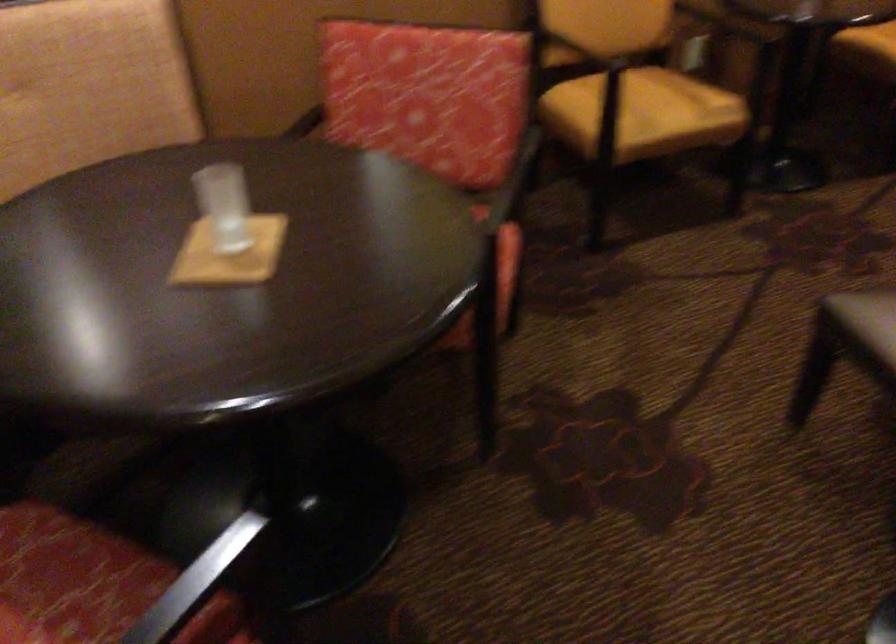
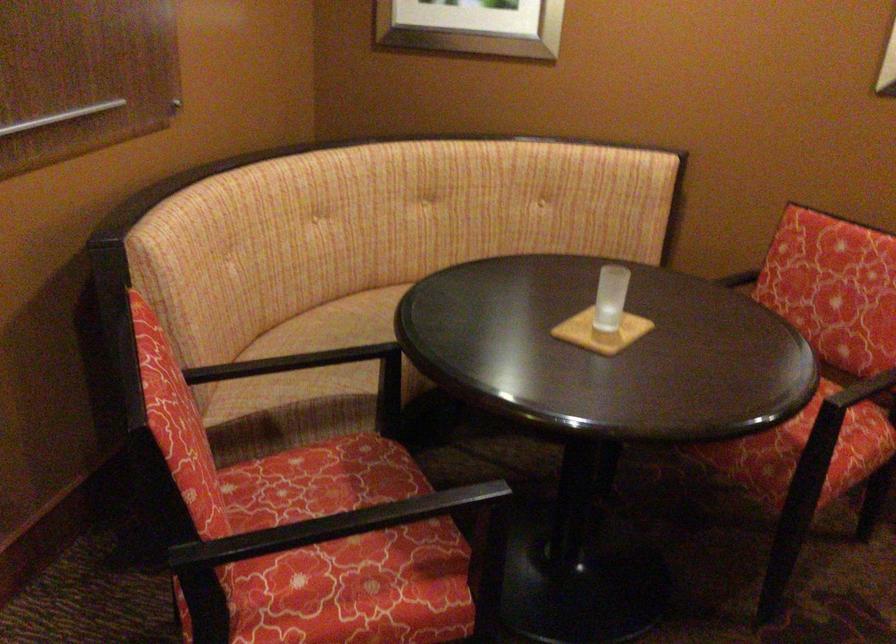
Locate, in the second image, the point that corresponds to [306,120] in the first image.

(738, 279)